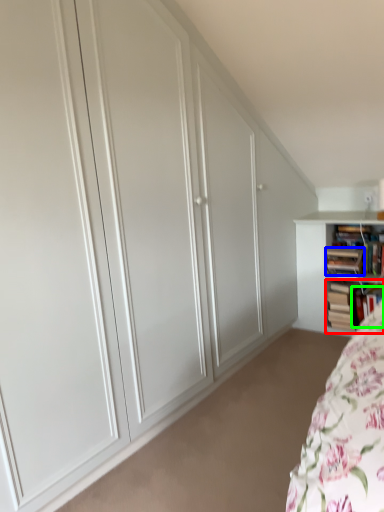
Question: Which object is positioned closest to book (highlighted by a red box)? Select from book (highlighted by a blue box) and book (highlighted by a green box).

Choices:
 (A) book
 (B) book

Answer: (B)